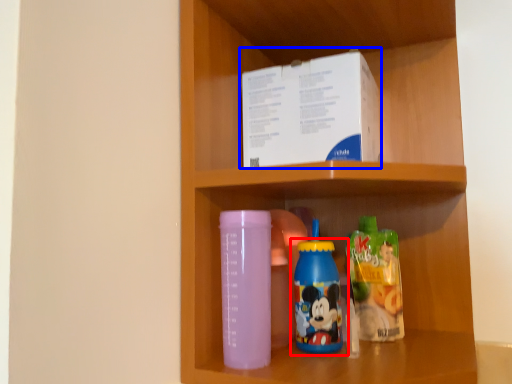
Question: Among these objects, which one is farthest to the camera, bottle (highlighted by a red box) or box (highlighted by a blue box)?

Choices:
 (A) bottle
 (B) box

Answer: (B)